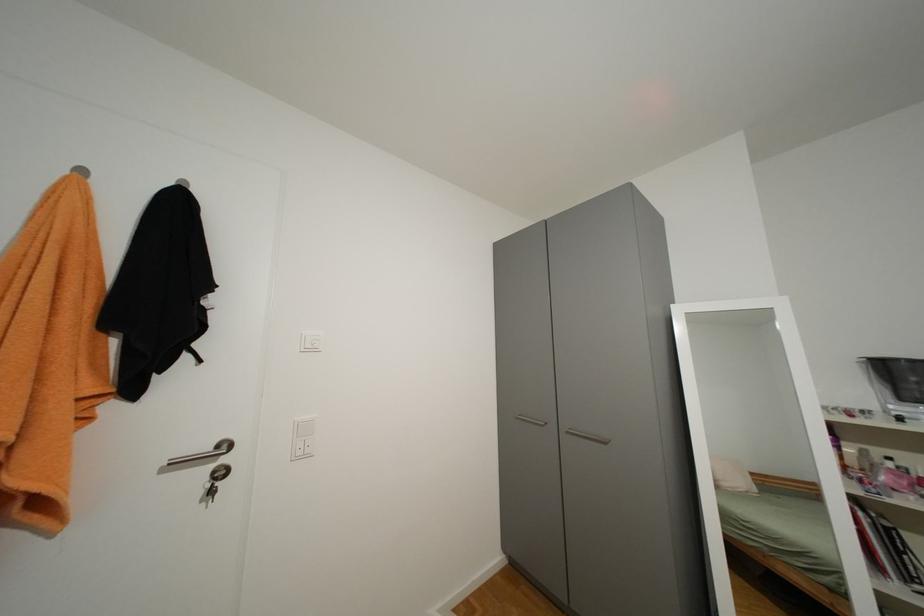
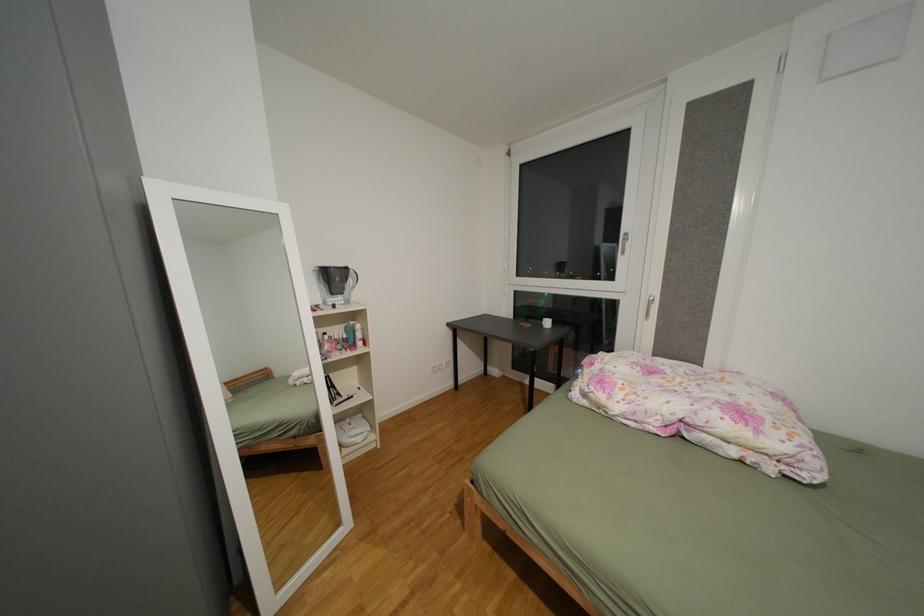
Question: The images are taken continuously from a first-person perspective. In which direction is your viewpoint rotating?

Choices:
 (A) Left
 (B) Right
 (C) Up
 (D) Down

Answer: (B)